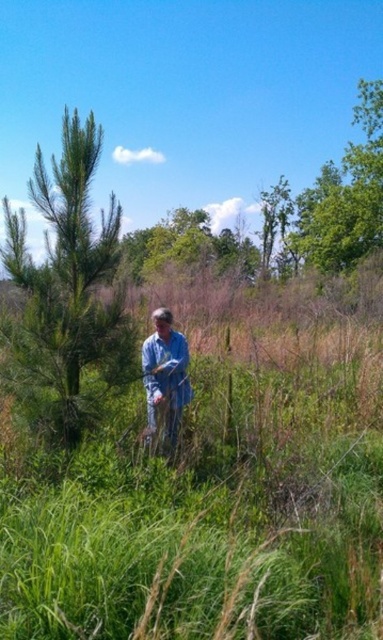
Which is above, green needle-like tree at left or blue denim shirt at center?

Positioned higher is green needle-like tree at left.

Does green needle-like tree at left have a smaller size compared to blue denim shirt at center?

Yes, green needle-like tree at left is smaller than blue denim shirt at center.

The width and height of the screenshot is (383, 640). Describe the element at coordinates (70, 282) in the screenshot. I see `green needle-like tree at left` at that location.

Locate an element on the screen. The height and width of the screenshot is (640, 383). green needle-like tree at left is located at coordinates (70, 282).